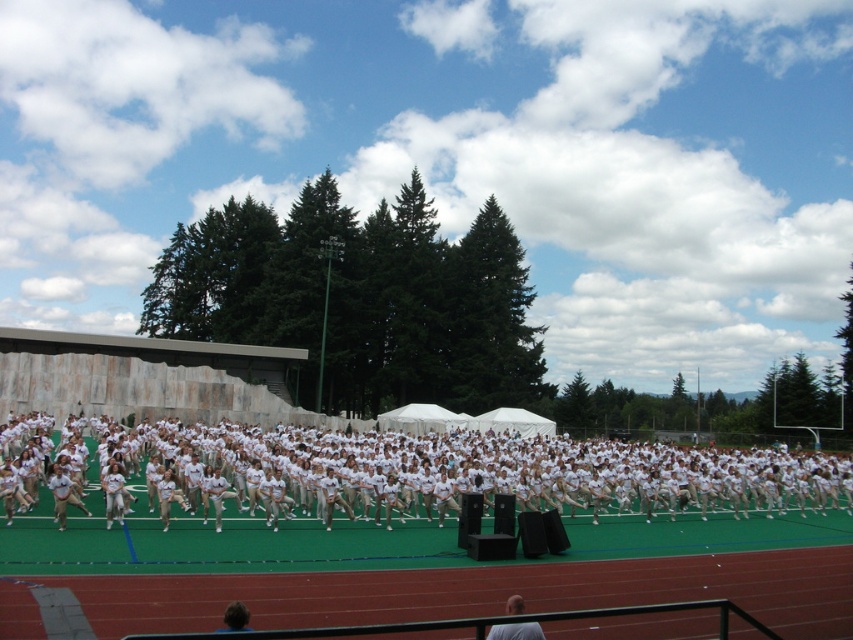
Can you confirm if white matte shirt at lower center is smaller than dark brown hair at lower center?

Indeed, white matte shirt at lower center has a smaller size compared to dark brown hair at lower center.

Is white matte shirt at lower center positioned in front of dark brown hair at lower center?

No.

Looking at this image, who is more forward, (519, 628) or (242, 618)?

Positioned in front is point (242, 618).

Where is `white matte shirt at lower center`? The height and width of the screenshot is (640, 853). white matte shirt at lower center is located at coordinates (515, 632).

I want to click on white matte uniform at center, so click(x=421, y=468).

Who is more distant from viewer, (195, 449) or (234, 609)?

Positioned behind is point (195, 449).

Identify the location of white matte uniform at center. The image size is (853, 640). (421, 468).

Is light brown uniform at center taller than dark brown hair at lower center?

No, light brown uniform at center is not taller than dark brown hair at lower center.

Who is higher up, light brown uniform at center or dark brown hair at lower center?

dark brown hair at lower center

Who is more forward, (61,529) or (244,608)?

Point (244,608) is more forward.

Locate an element on the screen. The width and height of the screenshot is (853, 640). light brown uniform at center is located at coordinates (62, 493).